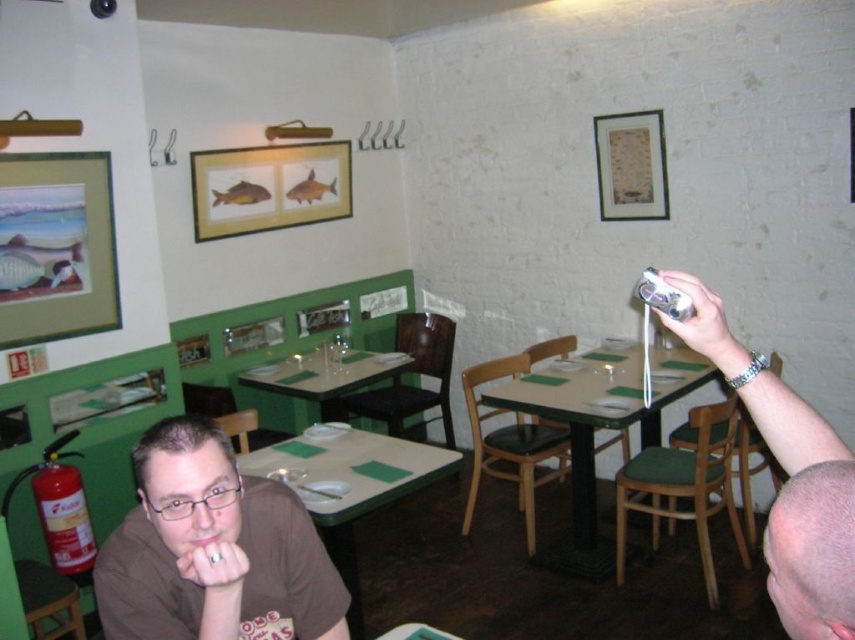
Looking at this image, you are a customer entering the restaurant and want to hang your coat on the nearest coat rack. The matte wooden picture frame at upper left is in your way. Is the coat rack closer to you than the frame?

The matte wooden picture frame at upper left is located at point (56, 248). Since the frame is in your path, you would need to move around it to reach the coat rack. However, without knowing the exact position of the coat rack, it is impossible to determine if it is closer to you than the frame.

You are a customer sitting at the green matte table at center in a cozy restaurant. You want to reach the restroom, which is located behind the wall with the green paneling on the left side. If you stand up and walk straight towards the wall, will you hit the framed picture of a fish on the wall before reaching the restroom?

The green matte table at center is located at point (x=352, y=486), so yes, you will hit the framed picture of a fish on the wall before reaching the restroom because the restroom is behind the wall with the green paneling on the left side, and the framed picture is on that wall.